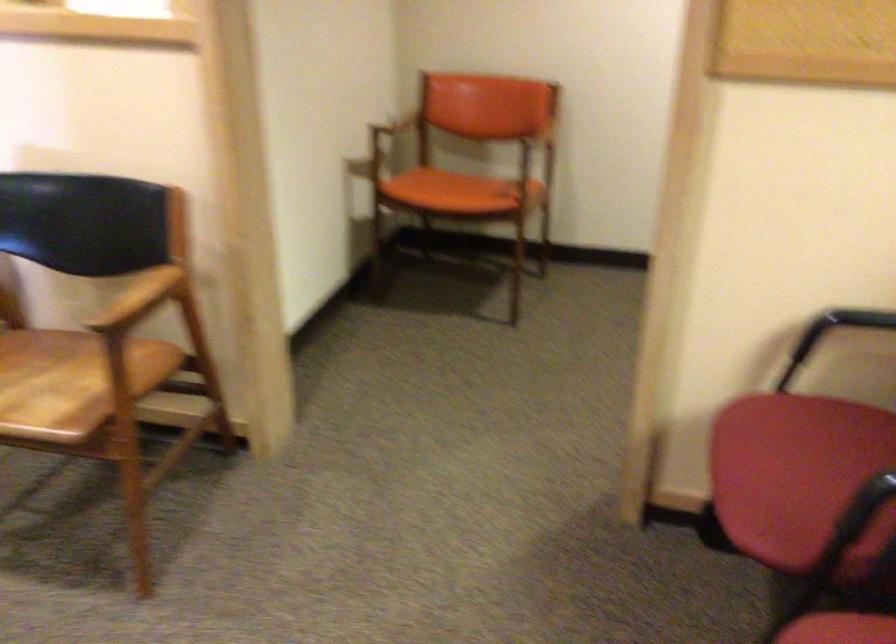
Describe the element at coordinates (865, 506) in the screenshot. The width and height of the screenshot is (896, 644). I see `a chair armrest` at that location.